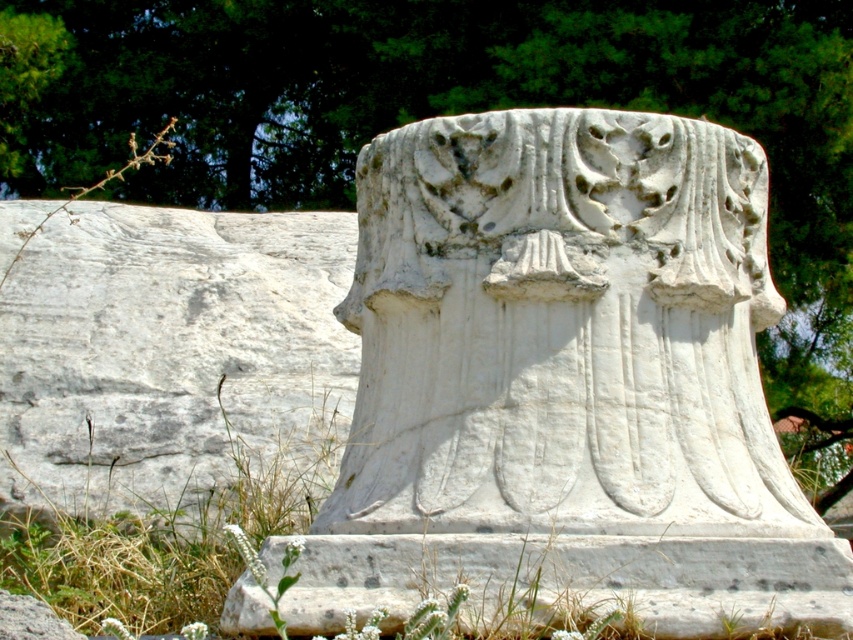
Which is below, white marble column at center or dry grass at lower left?

dry grass at lower left is lower down.

Find the location of a particular element. Image resolution: width=853 pixels, height=640 pixels. white marble column at center is located at coordinates (566, 380).